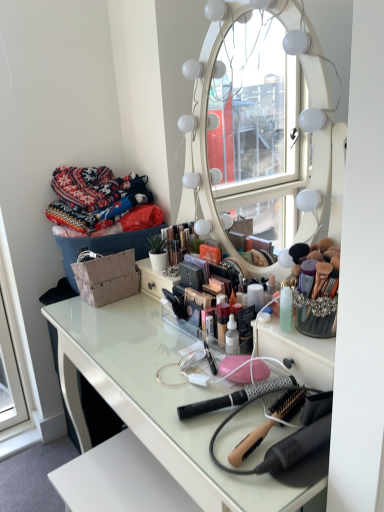
Image resolution: width=384 pixels, height=512 pixels. Identify the location of vacant space behind black plastic brush at center, the 1th brush when ordered from back to front. (195, 360).